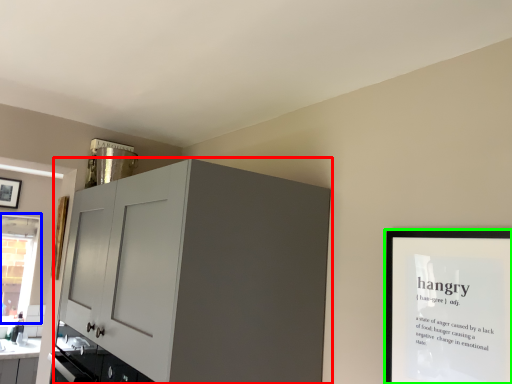
Question: Estimate the real-world distances between objects in this image. Which object is closer to cabinetry (highlighted by a red box), window (highlighted by a blue box) or picture frame (highlighted by a green box)?

Choices:
 (A) window
 (B) picture frame

Answer: (B)